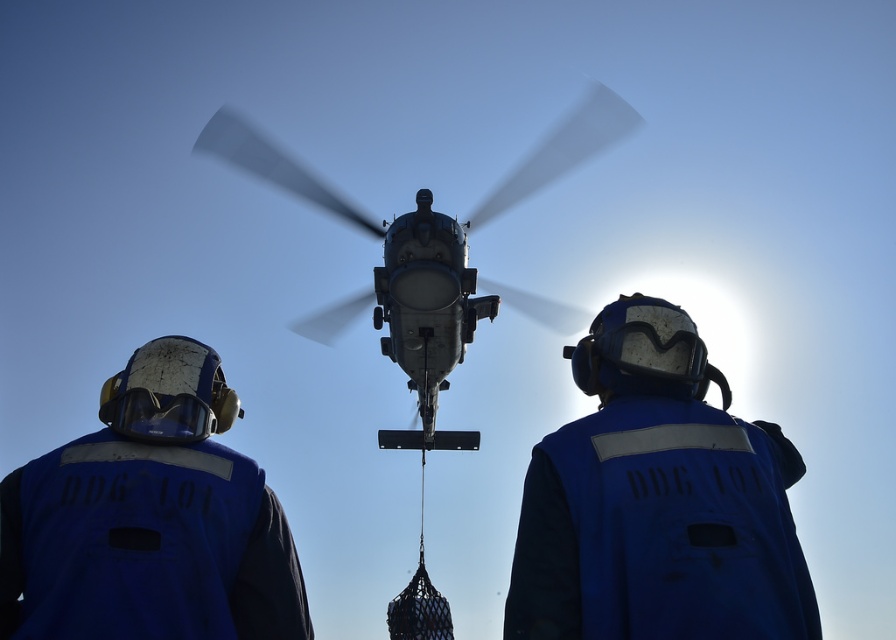
You are a drone operator observing the helicopter scene. You need to locate the blue fabric helmet at center in the image. What are its coordinates?

The blue fabric helmet at center is located at coordinates point (657, 500).

You are a safety inspector evaluating the protective gear of the two individuals in the scene. The blue fabric helmet at center and transparent plastic goggles at center are both present. Based on their sizes, which one provides a wider coverage area?

The blue fabric helmet at center has a larger width than the transparent plastic goggles at center, so it provides a wider coverage area.